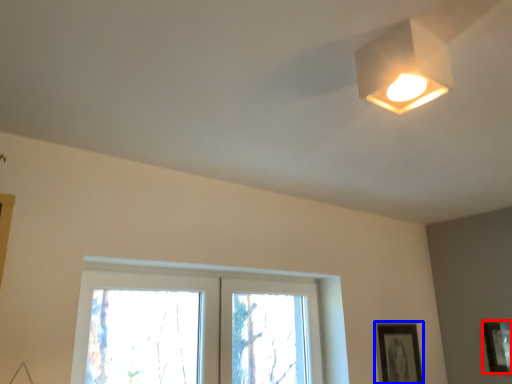
Question: Which of the following is the farthest to the observer, picture frame (highlighted by a red box) or picture frame (highlighted by a blue box)?

Choices:
 (A) picture frame
 (B) picture frame

Answer: (B)